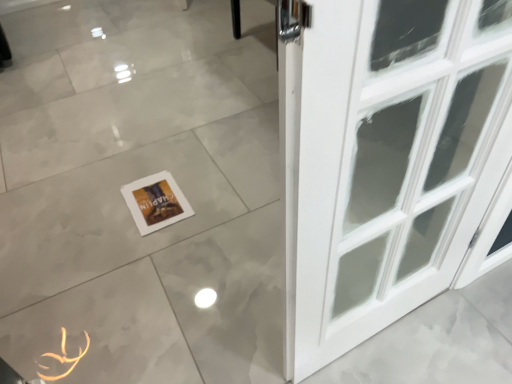
Question: Considering the relative sizes of white paper at lower center and orange rubber band at lower left in the image provided, is white paper at lower center taller than orange rubber band at lower left?

Choices:
 (A) no
 (B) yes

Answer: (B)

Question: From the image's perspective, would you say white paper at lower center is positioned over orange rubber band at lower left?

Choices:
 (A) no
 (B) yes

Answer: (B)

Question: Is white paper at lower center shorter than orange rubber band at lower left?

Choices:
 (A) no
 (B) yes

Answer: (A)

Question: Is white paper at lower center completely or partially outside of orange rubber band at lower left?

Choices:
 (A) yes
 (B) no

Answer: (A)

Question: Does white paper at lower center lie in front of orange rubber band at lower left?

Choices:
 (A) yes
 (B) no

Answer: (B)

Question: Would you say white glossy tile at center is to the left or to the right of orange rubber band at lower left in the picture?

Choices:
 (A) left
 (B) right

Answer: (B)

Question: Considering their positions, is white glossy tile at center located in front of or behind orange rubber band at lower left?

Choices:
 (A) front
 (B) behind

Answer: (A)

Question: From the image's perspective, relative to orange rubber band at lower left, is white glossy tile at center above or below?

Choices:
 (A) above
 (B) below

Answer: (A)

Question: Would you say white glossy tile at center is inside or outside orange rubber band at lower left?

Choices:
 (A) inside
 (B) outside

Answer: (B)

Question: From the image's perspective, is white glossy tile at center positioned above or below white paper at lower center?

Choices:
 (A) below
 (B) above

Answer: (B)

Question: Would you say white glossy tile at center is to the left or to the right of white paper at lower center in the picture?

Choices:
 (A) right
 (B) left

Answer: (A)

Question: In terms of height, does white glossy tile at center look taller or shorter compared to white paper at lower center?

Choices:
 (A) short
 (B) tall

Answer: (B)

Question: In terms of width, does white glossy tile at center look wider or thinner when compared to white paper at lower center?

Choices:
 (A) wide
 (B) thin

Answer: (A)

Question: From their relative heights in the image, would you say orange rubber band at lower left is taller or shorter than white glossy tile at center?

Choices:
 (A) tall
 (B) short

Answer: (B)

Question: Considering the relative positions of orange rubber band at lower left and white glossy tile at center in the image provided, is orange rubber band at lower left to the left or to the right of white glossy tile at center?

Choices:
 (A) right
 (B) left

Answer: (B)